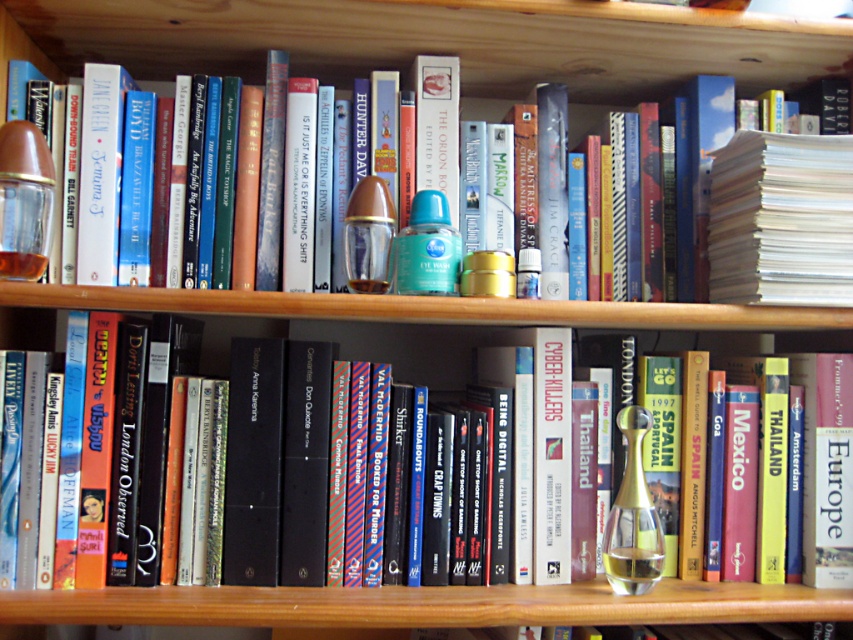
You are organizing a shelf and need to place a new item between the hardcover book at center and the matte glass perfume at left. The new item is 15 centimeters long. Can it fit in the space between them without overlapping?

The space between the hardcover book at center and the matte glass perfume at left is 18.58 centimeters. Since the new item is 15 centimeters long, it can fit in the space between them without overlapping.

You are organizing items on a wooden bookshelf. You have a hardcover book at center and a matte glass perfume at left. Which item is positioned more to the left?

The hardcover book at center is positioned more to the left than the matte glass perfume at left.

You are organizing a bookshelf and need to place a new book exactly at the center of the shelf. The shelf has a coordinate system where the bottom left corner is at point 0,0 and the top right corner is at 1,1. The hardcover book at center is already placed at point 0.541,0.431. Can you place the new book at the exact center of the shelf?

The exact center of the shelf would be at point (426, 320). The hardcover book at center is currently at (367, 346), which is slightly to the right and below the true center. Therefore, you can place the new book at (426, 320) to achieve the exact center.